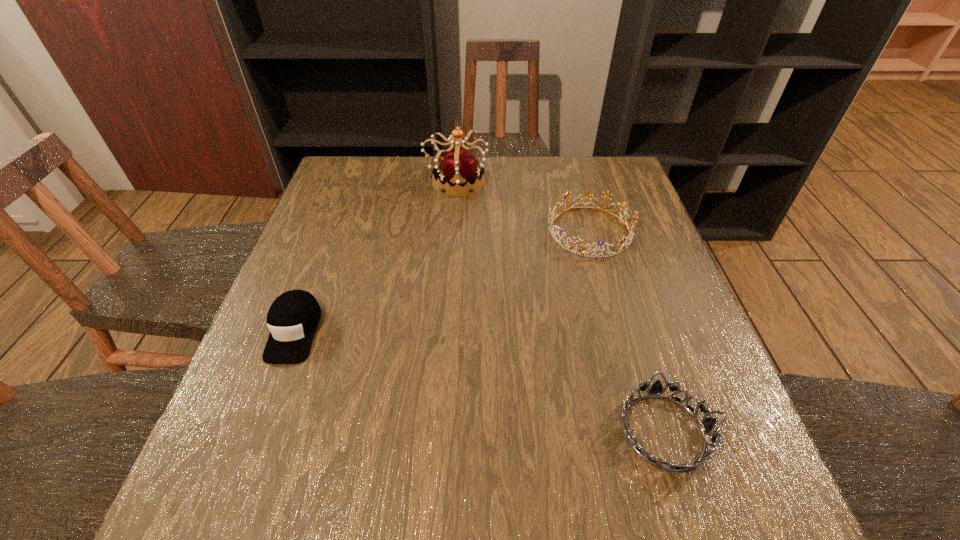
Locate an element on the screen. free space at the far edge of the desktop is located at coordinates (420, 196).

In the image, there is a desktop. Where is `vacant space at the near edge`? vacant space at the near edge is located at coordinates tap(328, 472).

This screenshot has height=540, width=960. In order to click on free space at the left edge in this screenshot , I will do `click(331, 334)`.

I want to click on vacant space at the right edge of the desktop, so click(664, 433).

Locate an element on the screen. vacant space at the far left corner of the desktop is located at coordinates (377, 166).

Identify the location of free space at the far right corner. The width and height of the screenshot is (960, 540). (611, 163).

Where is `vacant space that is in between the second nearest object and the farthest object`? vacant space that is in between the second nearest object and the farthest object is located at coordinates (375, 256).

Find the location of a particular element. Image resolution: width=960 pixels, height=540 pixels. free area in between the tallest object and the cap is located at coordinates (375, 256).

Where is `empty location between the leftmost object and the shortest object`? The height and width of the screenshot is (540, 960). empty location between the leftmost object and the shortest object is located at coordinates (479, 381).

You are a GUI agent. You are given a task and a screenshot of the screen. Output one action in this format:
    pyautogui.click(x=<x>, y=<y>)
    Task: Click on the unoccupied position between the second shortest tiara and the third farthest object
    Image resolution: width=960 pixels, height=540 pixels.
    Given the screenshot: What is the action you would take?
    pyautogui.click(x=442, y=281)